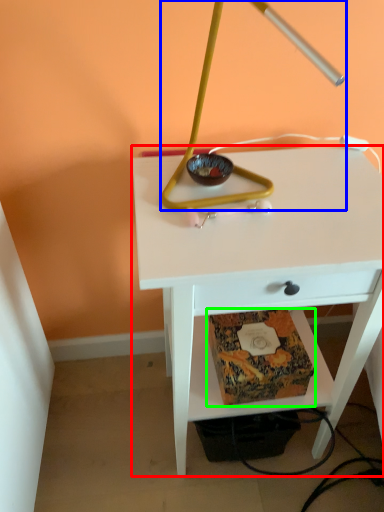
Question: Which object is positioned farthest from table (highlighted by a red box)? Select from lamp (highlighted by a blue box) and paperback book (highlighted by a green box).

Choices:
 (A) lamp
 (B) paperback book

Answer: (A)